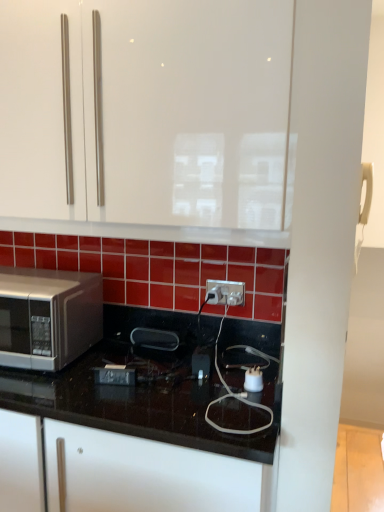
Locate an element on the screen. This screenshot has width=384, height=512. free space above satin silver microwave at left (from a real-world perspective) is located at coordinates (30, 273).